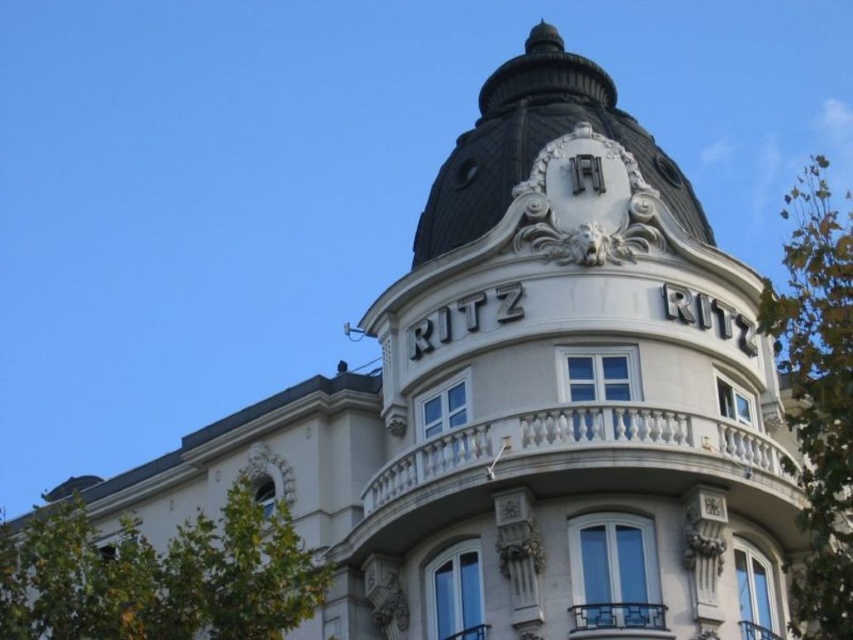
From the picture: You are standing in front of the grand building with the word RITZ. You notice a point marked at coordinates (158, 577). What object is located at that point?

The point at (158, 577) indicates a green leafy tree at lower left.